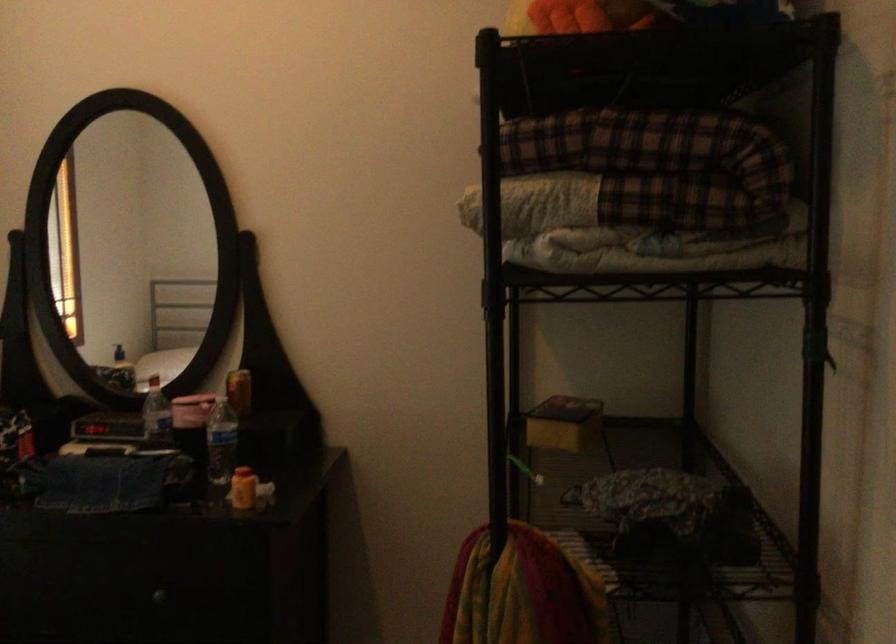
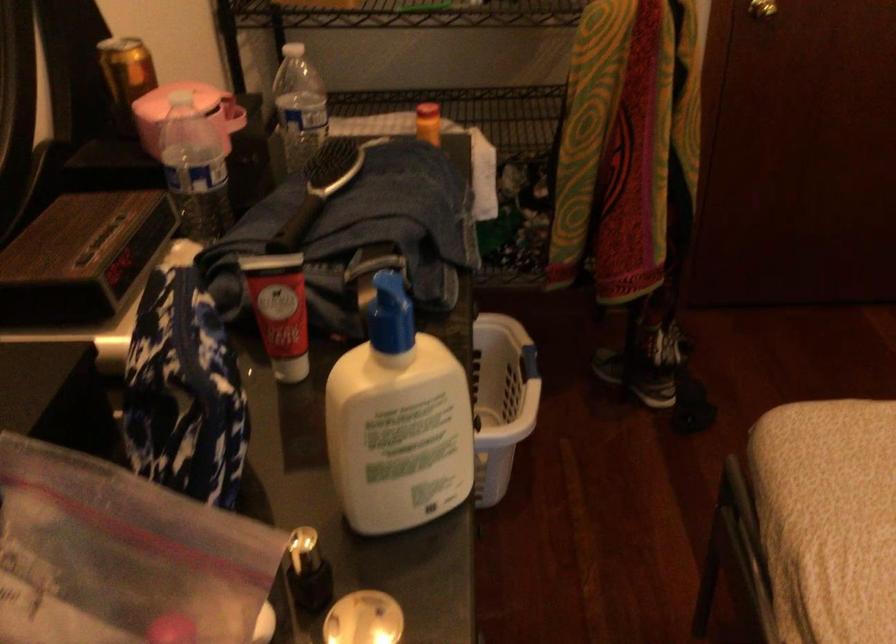
The point at (149, 415) is marked in the first image. Where is the corresponding point in the second image?

(194, 169)